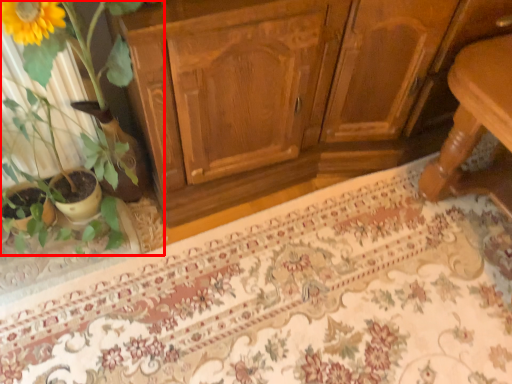
Question: From the image, what is the correct spatial relationship of houseplant (annotated by the red box) in relation to doormat?

Choices:
 (A) left
 (B) right

Answer: (A)